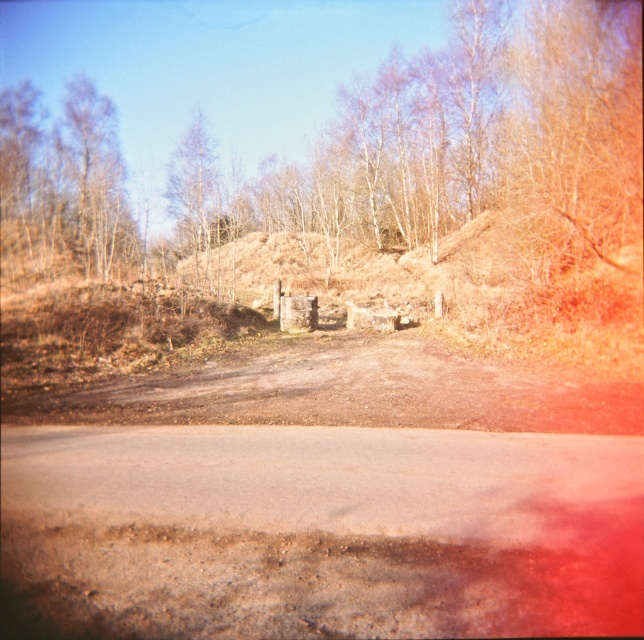
Question: Does dull gray asphalt at center appear under brown textured tree at upper center?

Choices:
 (A) no
 (B) yes

Answer: (B)

Question: Which point appears closest to the camera in this image?

Choices:
 (A) (90, 493)
 (B) (491, 108)

Answer: (A)

Question: Which of the following is the farthest from the observer?

Choices:
 (A) (211, 598)
 (B) (23, 108)

Answer: (B)

Question: Considering the relative positions of dull gray asphalt at center and brown textured tree at upper center in the image provided, where is dull gray asphalt at center located with respect to brown textured tree at upper center?

Choices:
 (A) right
 (B) left

Answer: (A)

Question: Can you confirm if dull gray asphalt at center is bigger than brown textured tree at upper center?

Choices:
 (A) yes
 (B) no

Answer: (B)